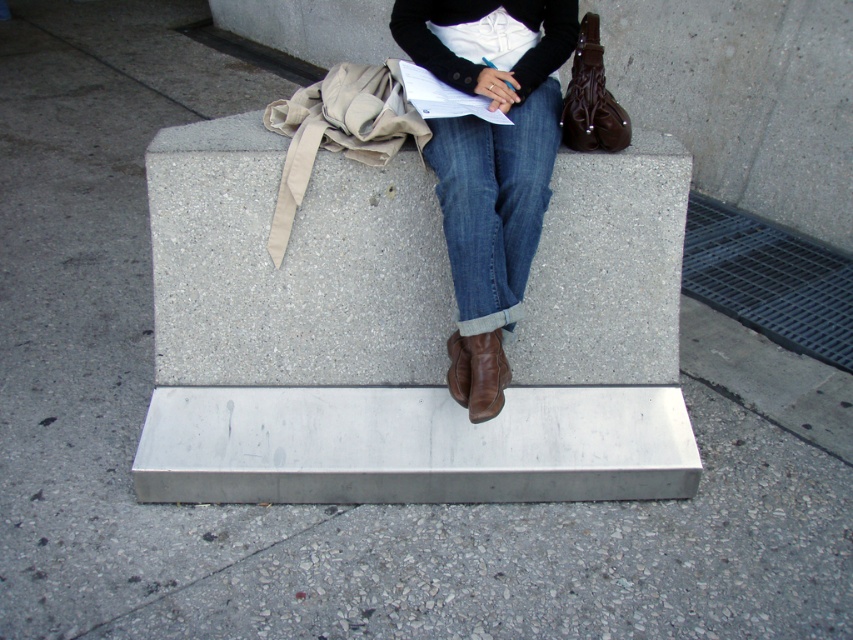
Between denim jeans at center and denim/cuffed jeans at center, which one is positioned higher?

denim/cuffed jeans at center is higher up.

Does denim jeans at center have a lesser height compared to denim/cuffed jeans at center?

No, denim jeans at center is not shorter than denim/cuffed jeans at center.

Where is `denim jeans at center`? denim jeans at center is located at coordinates (490, 163).

Who is shorter, denim jeans at center or brown leather boot at center?

brown leather boot at center is shorter.

Is denim jeans at center taller than brown leather boot at center?

Correct, denim jeans at center is much taller as brown leather boot at center.

Identify the location of denim jeans at center. The height and width of the screenshot is (640, 853). (490, 163).

Describe the element at coordinates (404, 333) in the screenshot. The width and height of the screenshot is (853, 640). I see `gray concrete bench at center` at that location.

Is gray concrete bench at center above denim/cuffed jeans at center?

Incorrect, gray concrete bench at center is not positioned above denim/cuffed jeans at center.

At what (x,y) coordinates should I click in order to perform the action: click on gray concrete bench at center. Please return your answer as a coordinate pair (x, y). Image resolution: width=853 pixels, height=640 pixels. Looking at the image, I should click on pyautogui.click(x=404, y=333).